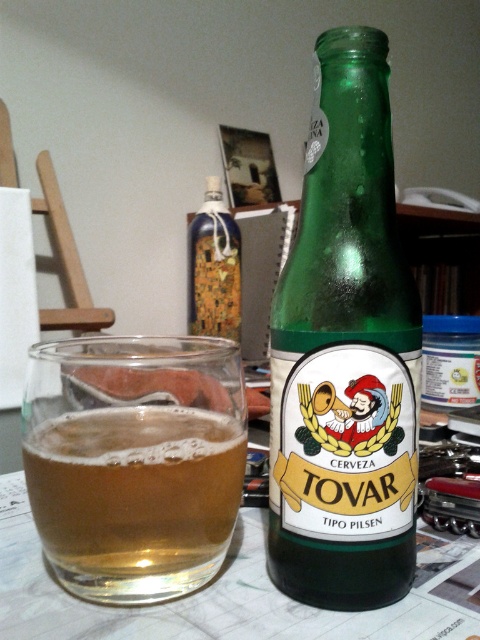
Question: Considering the real-world distances, which object is closest to the transparent glass at center?

Choices:
 (A) green glass bottle at center
 (B) blue glass bottle at center

Answer: (A)

Question: Estimate the real-world distances between objects in this image. Which object is closer to the transparent glass at center?

Choices:
 (A) green glass bottle at center
 (B) blue glass bottle at center

Answer: (A)

Question: Does green glass bottle at center have a larger size compared to transparent glass at center?

Choices:
 (A) no
 (B) yes

Answer: (B)

Question: In this image, where is green glass bottle at center located relative to transparent glass at center?

Choices:
 (A) above
 (B) below

Answer: (A)

Question: Can you confirm if green glass bottle at center is bigger than blue glass bottle at center?

Choices:
 (A) yes
 (B) no

Answer: (B)

Question: Among these objects, which one is nearest to the camera?

Choices:
 (A) blue glass bottle at center
 (B) transparent glass at center

Answer: (B)